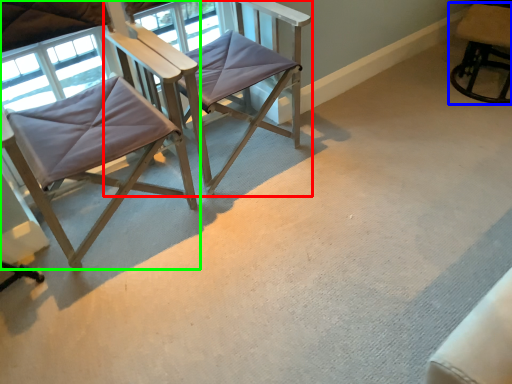
Question: Which object is positioned farthest from chair (highlighted by a red box)? Select from chair (highlighted by a blue box) and chair (highlighted by a green box).

Choices:
 (A) chair
 (B) chair

Answer: (A)